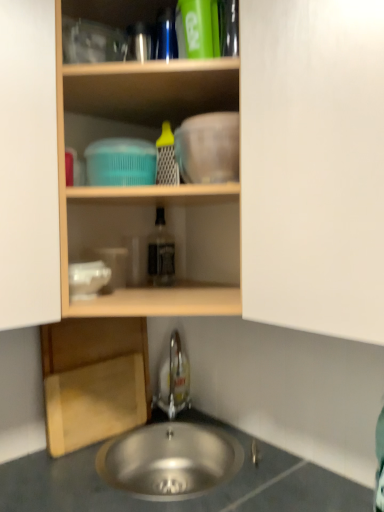
Question: From a real-world perspective, relative to wooden shelf at upper center, is stainless steel sink at lower center vertically above or below?

Choices:
 (A) above
 (B) below

Answer: (B)

Question: Considering the positions of point (150, 461) and point (105, 77), is point (150, 461) closer or farther from the camera than point (105, 77)?

Choices:
 (A) closer
 (B) farther

Answer: (B)

Question: Estimate the real-world distances between objects in this image. Which object is closer to the metallic gray sink at lower center?

Choices:
 (A) white matte cabinet at center
 (B) wooden shelf at upper center
 (C) satin nickel faucet at lower center
 (D) stainless steel sink at lower center
 (E) wooden cutting board at lower left

Answer: (D)

Question: Which of these objects is positioned farthest from the stainless steel sink at lower center?

Choices:
 (A) translucent glass bottle at center
 (B) wooden shelf at upper center
 (C) satin nickel faucet at lower center
 (D) white matte cabinet at center
 (E) wooden cutting board at lower left

Answer: (D)